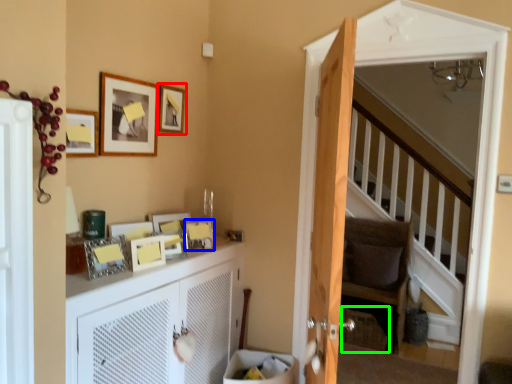
Question: Considering the real-world distances, which object is closest to picture frame (highlighted by a red box)? picture frame (highlighted by a blue box) or basket (highlighted by a green box).

Choices:
 (A) picture frame
 (B) basket

Answer: (A)